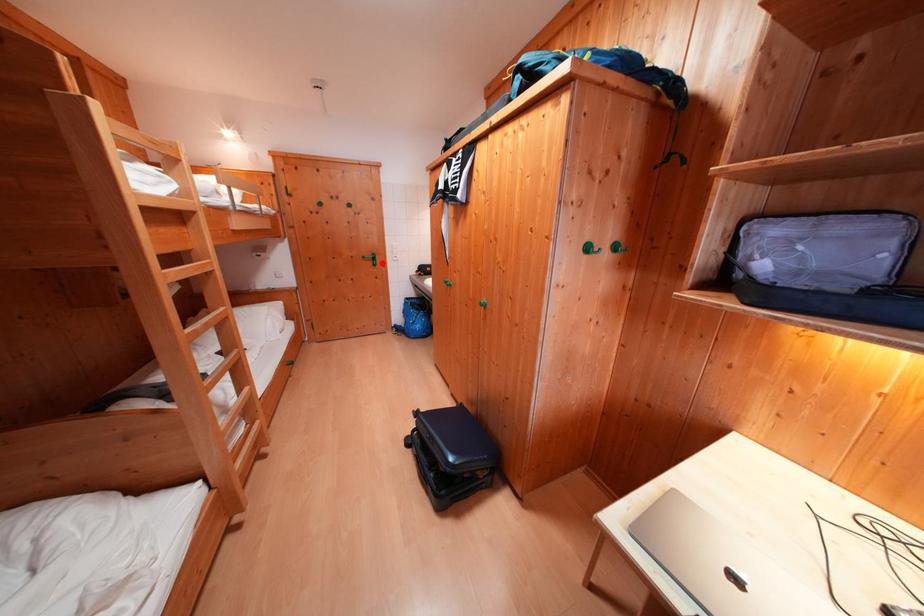
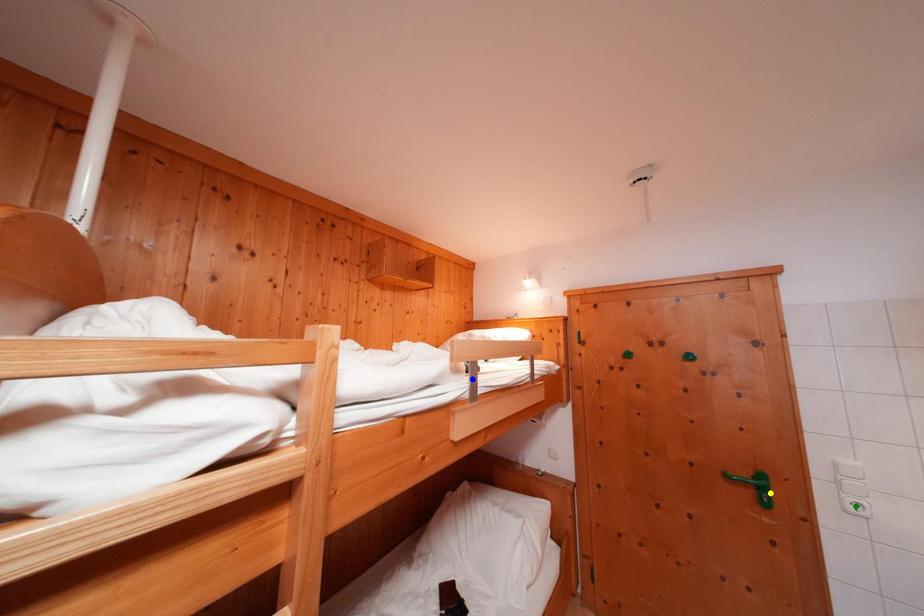
Question: I am providing you with two images of the same scene from different viewpoints. A red point is marked on the first image. You are given multiple points on the second image. In image 2, which mark is for the same physical point as the one in image 1?

Choices:
 (A) yellow point
 (B) green point
 (C) blue point

Answer: (A)